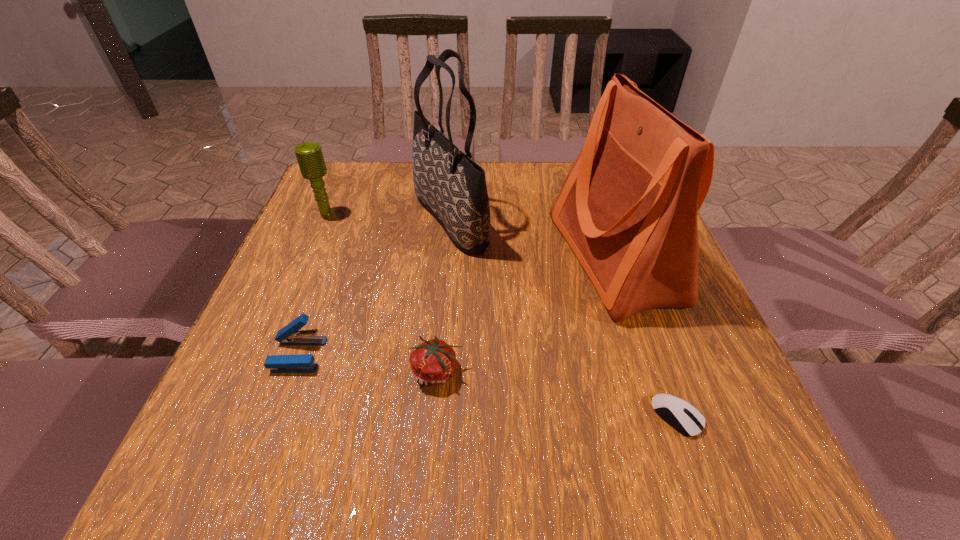
Where is `free space that is in between the tote bag and the tomato`? The width and height of the screenshot is (960, 540). free space that is in between the tote bag and the tomato is located at coordinates (444, 295).

Find the location of a particular element. Image resolution: width=960 pixels, height=540 pixels. empty space that is in between the shopping bag and the tote bag is located at coordinates (532, 239).

Where is `blank region between the tote bag and the tomato`? This screenshot has height=540, width=960. blank region between the tote bag and the tomato is located at coordinates (444, 295).

This screenshot has width=960, height=540. Find the location of `vacant region between the stapler and the tomato`. vacant region between the stapler and the tomato is located at coordinates (368, 363).

Locate an element on the screen. unoccupied position between the tomato and the shopping bag is located at coordinates coord(525,315).

Where is `empty space between the tote bag and the shopping bag`? This screenshot has height=540, width=960. empty space between the tote bag and the shopping bag is located at coordinates (532, 239).

Identify the location of unoccupied position between the shopping bag and the tomato. The image size is (960, 540). click(x=525, y=315).

Image resolution: width=960 pixels, height=540 pixels. In order to click on unoccupied area between the stapler and the tote bag in this screenshot , I will do `click(374, 287)`.

Identify the location of free spot between the nearest object and the shopping bag. (645, 338).

At what (x,y) coordinates should I click in order to perform the action: click on free space that is in between the nearest object and the stapler. Please return your answer as a coordinate pair (x, y). The width and height of the screenshot is (960, 540). Looking at the image, I should click on (488, 386).